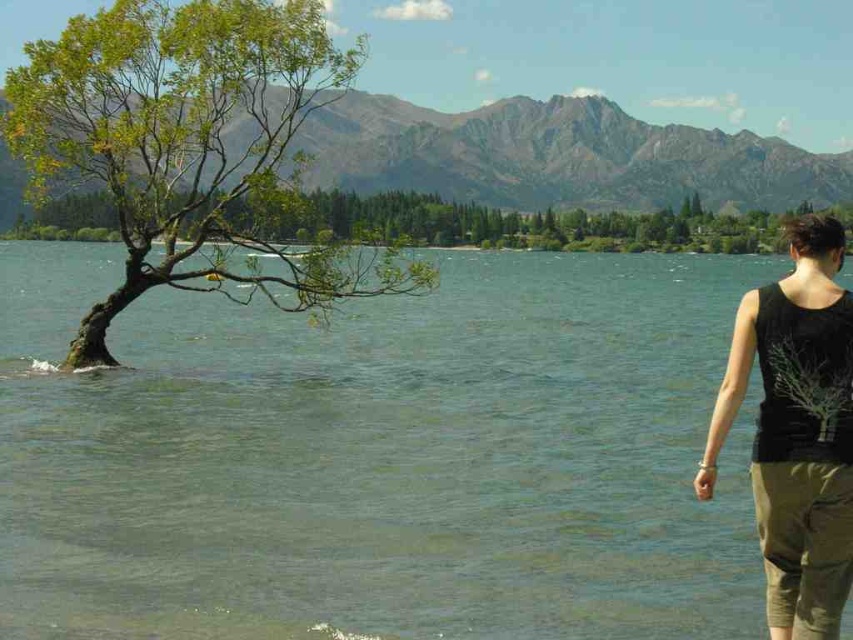
You are a photographer planning to capture the green leafy tree at left and the black cotton tank top at right in a single frame. Based on their sizes in the image, which object would appear larger in your photo?

The green leafy tree at left appears much larger than the black cotton tank top at right in the image because it is much taller as the tank top.

You are standing at the lakeside and see the point labeled as point (379, 456). Based on the scene description, can you determine if this point is on the water or on the land?

The point (379, 456) is on clear water at center, so it is on the water.

You are a photographer wanting to capture the black cotton tank top at right and the green leafy tree at left in the same frame. Can you see both objects clearly without one blocking the other?

The black cotton tank top at right is behind the green leafy tree at left, so the tank top would be obscured by the tree and not visible in the photo.